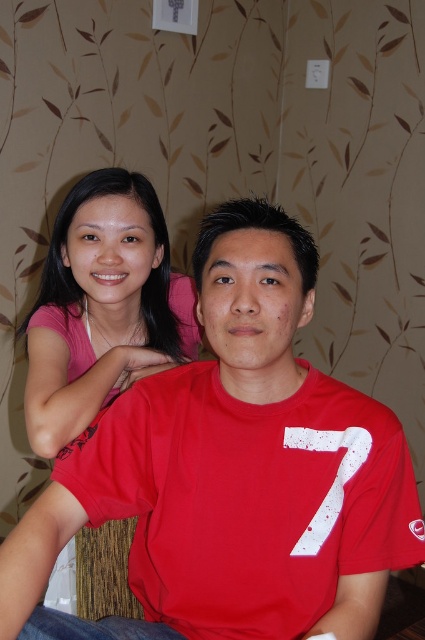
Question: Which point is closer to the camera?

Choices:
 (A) (169, 628)
 (B) (119, 374)

Answer: (A)

Question: Can you confirm if matte red t-shirt at center is positioned to the left of pink matte shirt at upper left?

Choices:
 (A) no
 (B) yes

Answer: (A)

Question: Does matte red t-shirt at center appear over pink matte shirt at upper left?

Choices:
 (A) yes
 (B) no

Answer: (B)

Question: Can you confirm if matte red t-shirt at center is positioned to the left of pink matte shirt at upper left?

Choices:
 (A) yes
 (B) no

Answer: (B)

Question: Among these points, which one is farthest from the camera?

Choices:
 (A) (142, 230)
 (B) (127, 499)

Answer: (A)

Question: Which object appears closest to the camera in this image?

Choices:
 (A) matte red t-shirt at center
 (B) pink matte shirt at upper left

Answer: (A)